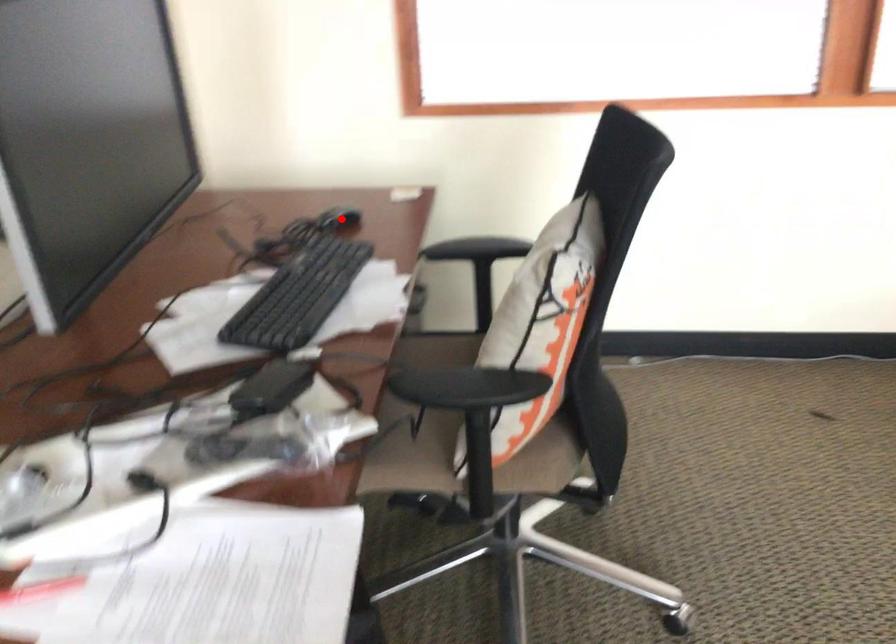
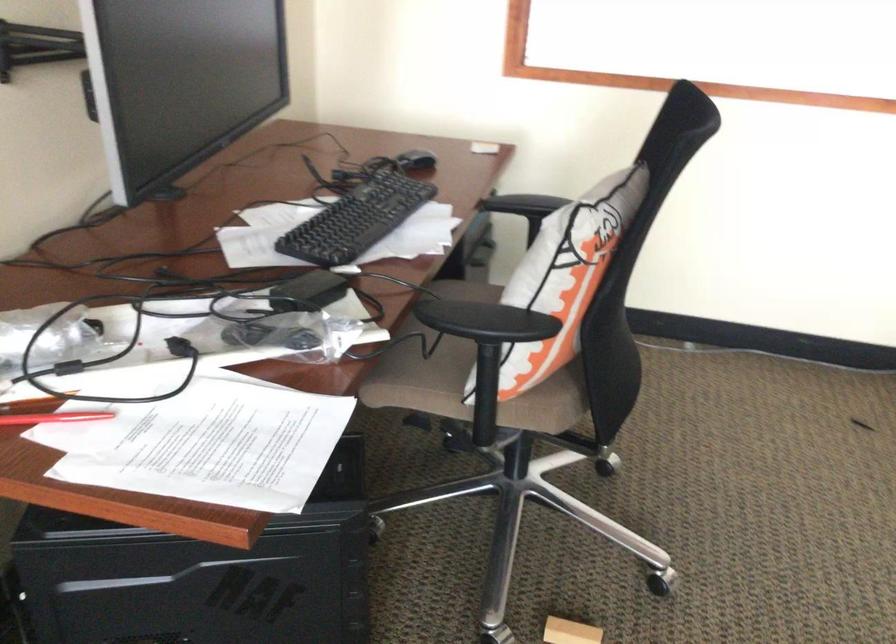
Find the pixel in the second image that matches the highlighted location in the first image.

(416, 162)